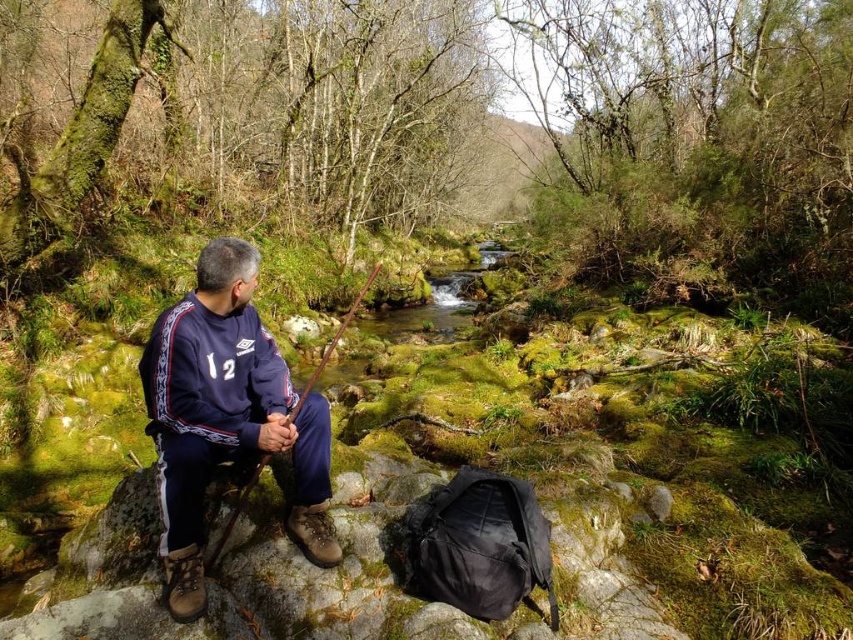
Which is above, dark blue fleece at center or brown wooden fishing pole at left?

brown wooden fishing pole at left is higher up.

Measure the distance between point (184, 339) and camera.

The distance of point (184, 339) from camera is 2.26 meters.

The image size is (853, 640). I want to click on dark blue fleece at center, so click(225, 417).